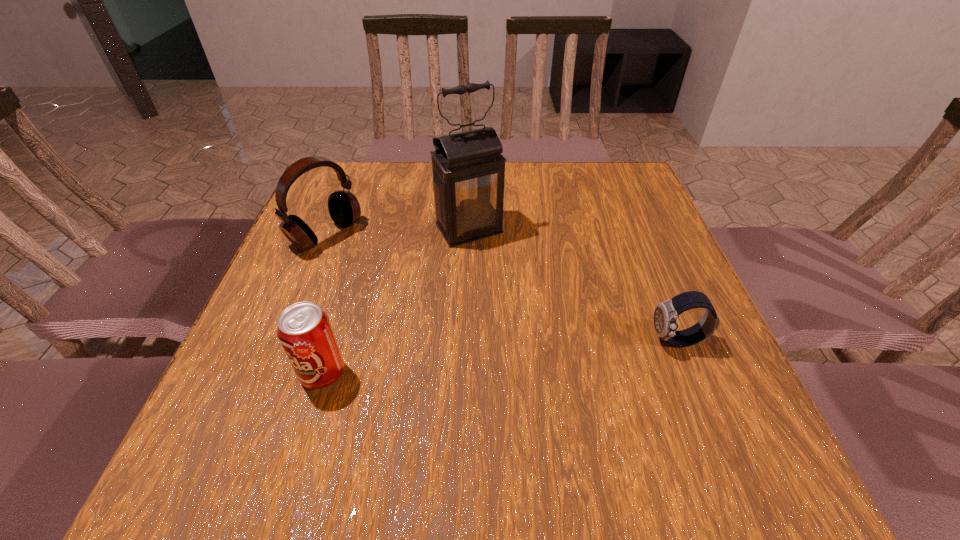
Where is `blank area in the image that satisfies the following two spatial constraints: 1. on the front side of the headset; 2. on the face of the watch`? This screenshot has height=540, width=960. blank area in the image that satisfies the following two spatial constraints: 1. on the front side of the headset; 2. on the face of the watch is located at coordinates (284, 341).